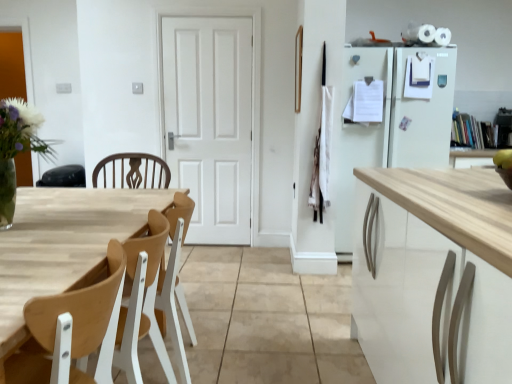
Find the location of a particular element. The image size is (512, 384). vacant space situated above white matte door at center (from a real-world perspective) is located at coordinates (203, 18).